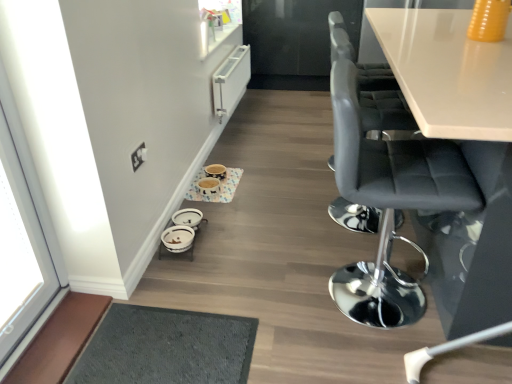
Where is `free space on the front side of white ceramic bowls at lower center, which is the 2th round table in back-to-front order`? free space on the front side of white ceramic bowls at lower center, which is the 2th round table in back-to-front order is located at coordinates (186, 270).